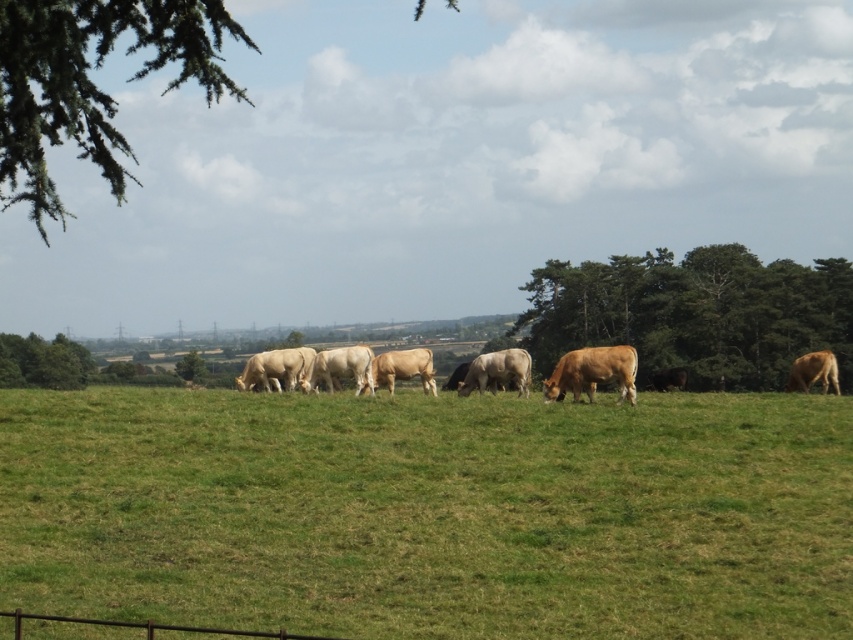
Question: Is green grassy field at center thinner than white smooth cow at center?

Choices:
 (A) yes
 (B) no

Answer: (B)

Question: Is light brown smooth cow at center positioned before brown smooth cow at right?

Choices:
 (A) yes
 (B) no

Answer: (A)

Question: Is light brown smooth cow at center to the left of green leafy tree at lower left from the viewer's perspective?

Choices:
 (A) no
 (B) yes

Answer: (A)

Question: Which point is closer to the camera?

Choices:
 (A) (61, 340)
 (B) (425, 371)
 (C) (309, 353)

Answer: (B)

Question: Based on their relative distances, which object is farther from the green leafy trees at right?

Choices:
 (A) light brown smooth cow at center
 (B) white smooth cow at center

Answer: (B)

Question: Considering the real-world distances, which object is farthest from the light brown glossy cow at center?

Choices:
 (A) green leafy tree at left
 (B) white smooth cow at center
 (C) light brown cow at center

Answer: (A)